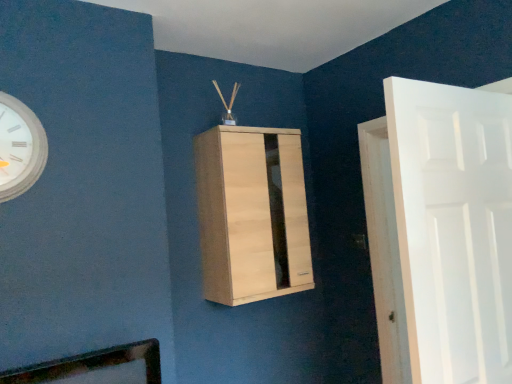
Question: Considering the positions of white matte door at right and white matte clock at upper left in the image, is white matte door at right wider or thinner than white matte clock at upper left?

Choices:
 (A) wide
 (B) thin

Answer: (A)

Question: Do you think white matte door at right is within white matte clock at upper left, or outside of it?

Choices:
 (A) inside
 (B) outside

Answer: (B)

Question: Which object is the farthest from the light wood cabinet at center?

Choices:
 (A) white matte clock at upper left
 (B) white matte door at right

Answer: (A)

Question: Which object is positioned closest to the white matte door at right?

Choices:
 (A) white matte clock at upper left
 (B) light wood cabinet at center

Answer: (B)